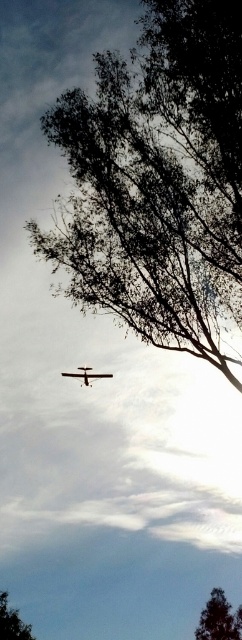
Is green leafy tree at upper center in front of metallic silver airplane at center?

Answer: Yes, green leafy tree at upper center is in front of metallic silver airplane at center.

Find the location of `green leafy tree at upper center`. green leafy tree at upper center is located at coordinates (157, 179).

Image resolution: width=242 pixels, height=640 pixels. In order to click on green leafy tree at upper center in this screenshot , I will do `click(157, 179)`.

The image size is (242, 640). What do you see at coordinates (12, 621) in the screenshot?
I see `green leafy tree at lower left` at bounding box center [12, 621].

Which is more to the right, green leafy tree at lower left or metallic silver airplane at center?

metallic silver airplane at center is more to the right.

Does point (25, 628) come closer to viewer compared to point (88, 376)?

No, it is behind (88, 376).

Locate an element on the screen. green leafy tree at lower left is located at coordinates (12, 621).

Does green leafy tree at upper center appear over green leafy tree at lower right?

Indeed, green leafy tree at upper center is positioned over green leafy tree at lower right.

Can you confirm if green leafy tree at upper center is bigger than green leafy tree at lower right?

Yes, green leafy tree at upper center is bigger than green leafy tree at lower right.

Describe the element at coordinates (157, 179) in the screenshot. I see `green leafy tree at upper center` at that location.

Where is `green leafy tree at upper center`? green leafy tree at upper center is located at coordinates (157, 179).